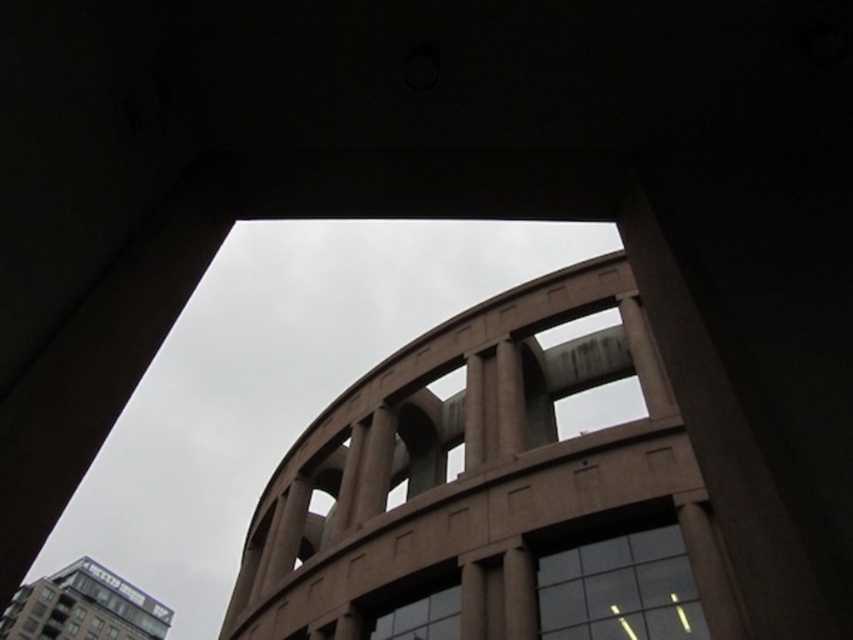
In the scene shown: You are an architect evaluating the structural integrity of the transparent glass window at center and the glassy reflective building at lower left. Which object has a smaller size?

The transparent glass window at center has a smaller size compared to the glassy reflective building at lower left.

You are standing on the ground floor of this building and looking up. You see the glassy reflective building at lower left and the clear glass window at center. Which object is positioned lower in your view?

The glassy reflective building at lower left is positioned lower than the clear glass window at center in your view.